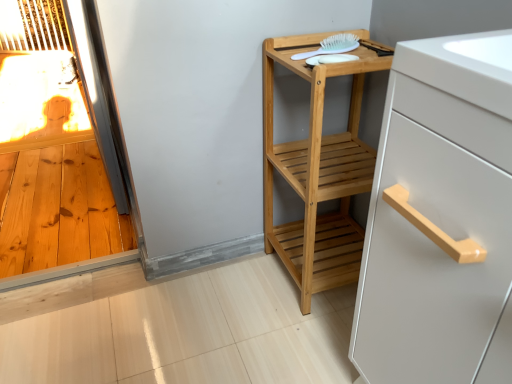
Question: Is natural wood shelf at center positioned behind white matte cabinet handle at upper right?

Choices:
 (A) no
 (B) yes

Answer: (B)

Question: From the image's perspective, is natural wood shelf at center beneath white matte cabinet handle at upper right?

Choices:
 (A) no
 (B) yes

Answer: (A)

Question: Is white matte cabinet handle at upper right located within natural wood shelf at center?

Choices:
 (A) no
 (B) yes

Answer: (A)

Question: Is the position of natural wood shelf at center less distant than that of white matte cabinet handle at upper right?

Choices:
 (A) no
 (B) yes

Answer: (A)

Question: Does natural wood shelf at center have a lesser height compared to white matte cabinet handle at upper right?

Choices:
 (A) yes
 (B) no

Answer: (A)

Question: Is white matte cabinet handle at upper right at the back of natural wood shelf at center?

Choices:
 (A) yes
 (B) no

Answer: (B)

Question: Considering the relative positions of white plastic brush at upper right and white matte cabinet handle at upper right in the image provided, is white plastic brush at upper right in front of white matte cabinet handle at upper right?

Choices:
 (A) no
 (B) yes

Answer: (A)

Question: Is white plastic brush at upper right thinner than white matte cabinet handle at upper right?

Choices:
 (A) no
 (B) yes

Answer: (B)

Question: Is white plastic brush at upper right further to the viewer compared to white matte cabinet handle at upper right?

Choices:
 (A) yes
 (B) no

Answer: (A)

Question: Is white plastic brush at upper right oriented away from white matte cabinet handle at upper right?

Choices:
 (A) yes
 (B) no

Answer: (B)

Question: Is white plastic brush at upper right outside of white matte cabinet handle at upper right?

Choices:
 (A) no
 (B) yes

Answer: (B)

Question: Does white plastic brush at upper right have a smaller size compared to white matte cabinet handle at upper right?

Choices:
 (A) no
 (B) yes

Answer: (B)

Question: Considering the relative positions of white plastic brush at upper right and natural wood shelf at center in the image provided, is white plastic brush at upper right behind natural wood shelf at center?

Choices:
 (A) yes
 (B) no

Answer: (A)